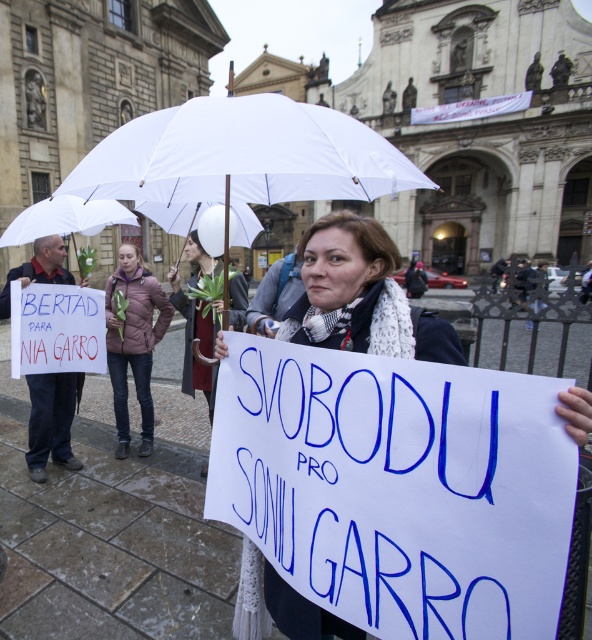
Question: Which of the following is the farthest from the observer?

Choices:
 (A) (155, 284)
 (B) (130, 168)
 (C) (75, 224)
 (D) (246, 291)

Answer: (A)

Question: Is white paper sign at center below purple down jacket at center?

Choices:
 (A) yes
 (B) no

Answer: (B)

Question: Which of the following is the farthest from the observer?

Choices:
 (A) white fabric umbrella at upper center
 (B) white matte umbrella at center
 (C) white paper sign at center
 (D) purple down jacket at center

Answer: (D)

Question: Which point appears farthest from the camera in this image?

Choices:
 (A) (207, 342)
 (B) (101, 202)

Answer: (B)

Question: Can you confirm if white paper sign at center is thinner than purple down jacket at center?

Choices:
 (A) no
 (B) yes

Answer: (B)

Question: Observing the image, what is the correct spatial positioning of white matte umbrella at center in reference to purple down jacket at center?

Choices:
 (A) below
 (B) above

Answer: (B)